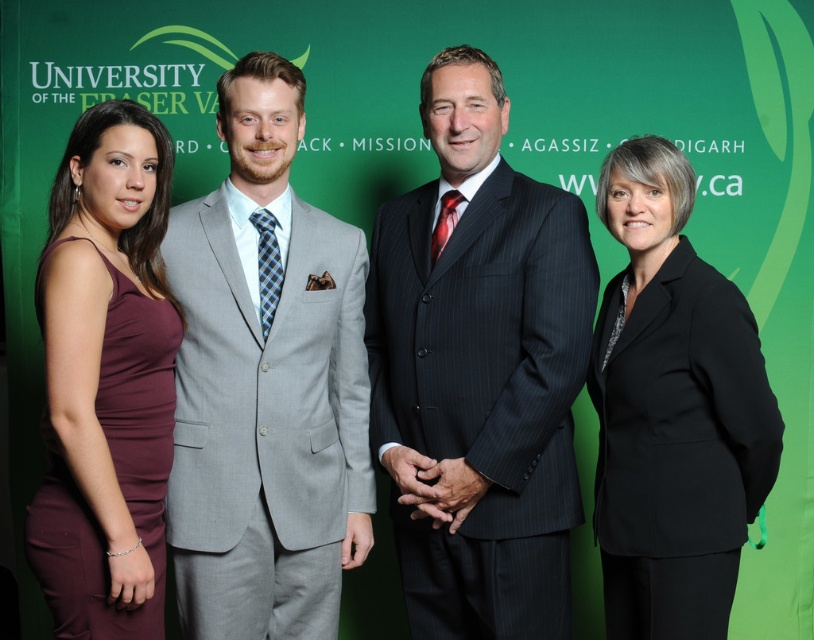
Question: Is black matte blazer at right to the right of maroon satin dress at left from the viewer's perspective?

Choices:
 (A) yes
 (B) no

Answer: (A)

Question: Which object is the farthest from the dark gray pinstripe suit at center?

Choices:
 (A) black matte blazer at right
 (B) light gray suit at center

Answer: (B)

Question: Considering the real-world distances, which object is closest to the light gray suit at center?

Choices:
 (A) dark gray pinstripe suit at center
 (B) black matte blazer at right

Answer: (A)

Question: Does dark gray pinstripe suit at center appear under light gray suit at center?

Choices:
 (A) no
 (B) yes

Answer: (A)

Question: Which point is farther to the camera?

Choices:
 (A) dark gray pinstripe suit at center
 (B) black matte blazer at right

Answer: (A)

Question: Can you confirm if dark gray pinstripe suit at center is positioned to the right of black matte blazer at right?

Choices:
 (A) no
 (B) yes

Answer: (A)